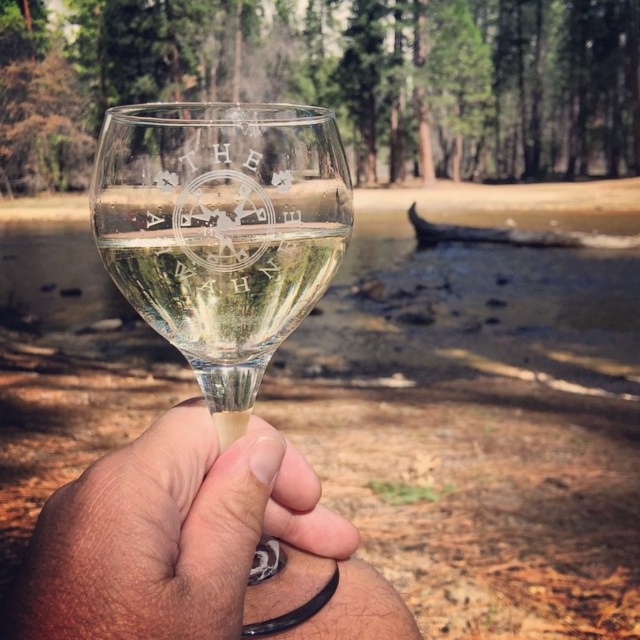
Which is above, translucent glass at center or clear glass wine glass at center?

Positioned higher is clear glass wine glass at center.

Based on the photo, how distant is translucent glass at center from clear glass wine glass at center?

They are 3.33 centimeters apart.

The width and height of the screenshot is (640, 640). Describe the element at coordinates (195, 545) in the screenshot. I see `translucent glass at center` at that location.

You are a GUI agent. You are given a task and a screenshot of the screen. Output one action in this format:
    pyautogui.click(x=<x>, y=<y>)
    Task: Click on the translucent glass at center
    Image resolution: width=640 pixels, height=640 pixels.
    Given the screenshot: What is the action you would take?
    pyautogui.click(x=195, y=545)

This screenshot has width=640, height=640. What do you see at coordinates (221, 230) in the screenshot? I see `clear glass wine glass at center` at bounding box center [221, 230].

Between clear glass wine glass at center and clear glass wine at center, which one appears on the right side from the viewer's perspective?

Positioned to the right is clear glass wine at center.

Locate an element on the screen. The image size is (640, 640). clear glass wine glass at center is located at coordinates (221, 230).

Consider the image. Does translucent glass at center have a lesser width compared to clear glass wine at center?

No.

From the picture: Does translucent glass at center appear over clear glass wine at center?

No, translucent glass at center is not above clear glass wine at center.

Which is behind, point (364, 604) or point (205, 305)?

The point (364, 604) is behind.

I want to click on translucent glass at center, so click(x=195, y=545).